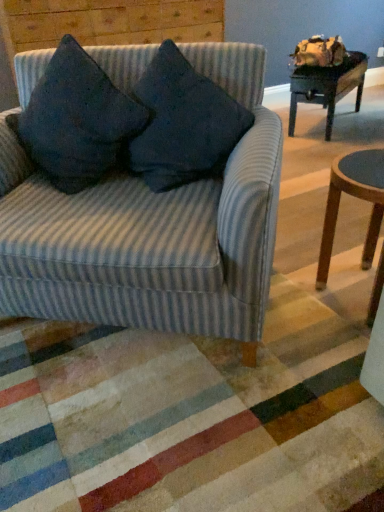
Question: Considering the relative sizes of dark blue fabric pillow at center, which appears as the 1th throw pillow when viewed from the right, and dark blue fabric pillow at upper left, which appears as the first throw pillow when viewed from the left, in the image provided, is dark blue fabric pillow at center, which appears as the 1th throw pillow when viewed from the right, taller than dark blue fabric pillow at upper left, which appears as the first throw pillow when viewed from the left,?

Choices:
 (A) yes
 (B) no

Answer: (B)

Question: Can you confirm if dark blue fabric pillow at center, which appears as the 1th throw pillow when viewed from the right, is smaller than dark blue fabric pillow at upper left, positioned as the second throw pillow in right-to-left order?

Choices:
 (A) no
 (B) yes

Answer: (B)

Question: Is dark blue fabric pillow at center, which appears as the 1th throw pillow when viewed from the right, facing away from dark blue fabric pillow at upper left, positioned as the second throw pillow in right-to-left order?

Choices:
 (A) yes
 (B) no

Answer: (B)

Question: Could you tell me if dark blue fabric pillow at center, acting as the second throw pillow starting from the left, is facing dark blue fabric pillow at upper left, which appears as the first throw pillow when viewed from the left?

Choices:
 (A) yes
 (B) no

Answer: (B)

Question: Does dark blue fabric pillow at center, acting as the second throw pillow starting from the left, have a lesser height compared to dark blue fabric pillow at upper left, positioned as the second throw pillow in right-to-left order?

Choices:
 (A) yes
 (B) no

Answer: (A)

Question: Does dark blue fabric pillow at center, which appears as the 1th throw pillow when viewed from the right, appear on the right side of dark blue fabric pillow at upper left, which appears as the first throw pillow when viewed from the left?

Choices:
 (A) yes
 (B) no

Answer: (A)

Question: Can you confirm if wooden round stool at lower right is smaller than dark blue fabric pillow at upper left, positioned as the second throw pillow in right-to-left order?

Choices:
 (A) yes
 (B) no

Answer: (A)

Question: Considering the relative sizes of wooden round stool at lower right and dark blue fabric pillow at upper left, which appears as the first throw pillow when viewed from the left, in the image provided, is wooden round stool at lower right taller than dark blue fabric pillow at upper left, which appears as the first throw pillow when viewed from the left,?

Choices:
 (A) yes
 (B) no

Answer: (A)

Question: Are wooden round stool at lower right and dark blue fabric pillow at upper left, positioned as the second throw pillow in right-to-left order, located far from each other?

Choices:
 (A) yes
 (B) no

Answer: (B)

Question: Is wooden round stool at lower right oriented away from dark blue fabric pillow at upper left, which appears as the first throw pillow when viewed from the left?

Choices:
 (A) no
 (B) yes

Answer: (A)

Question: Does wooden round stool at lower right have a greater width compared to dark blue fabric pillow at upper left, positioned as the second throw pillow in right-to-left order?

Choices:
 (A) yes
 (B) no

Answer: (A)

Question: Does wooden round stool at lower right turn towards dark blue fabric pillow at upper left, which appears as the first throw pillow when viewed from the left?

Choices:
 (A) no
 (B) yes

Answer: (A)

Question: From a real-world perspective, is dark blue fabric pillow at upper left, positioned as the second throw pillow in right-to-left order, located higher than dark blue fabric cushion at upper left?

Choices:
 (A) yes
 (B) no

Answer: (B)